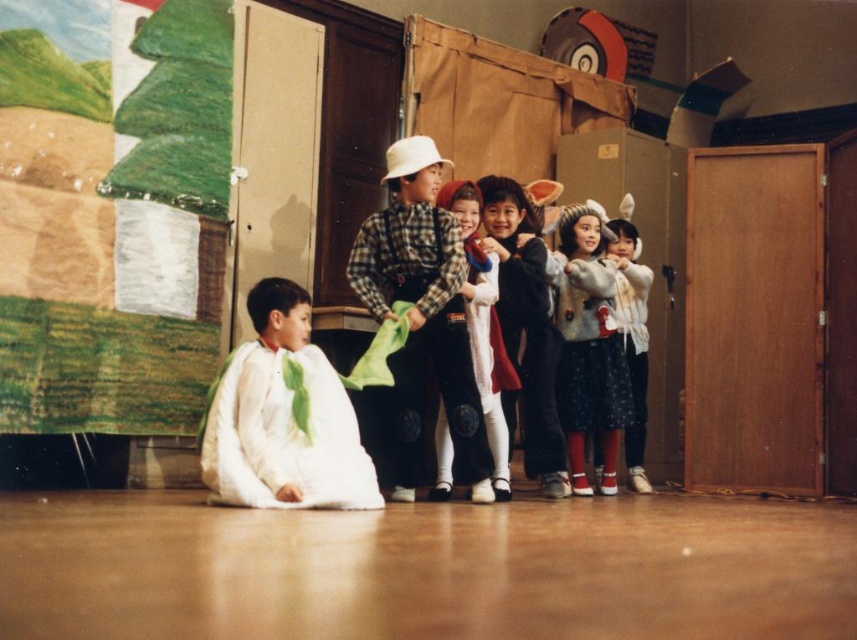
Question: Which of the following is the closest to the observer?

Choices:
 (A) fluffy white sweater at center
 (B) checkered fabric shirt at center
 (C) fuzzy gray sweater at center
 (D) green fabric tie at lower center

Answer: (D)

Question: From the image, what is the correct spatial relationship of white matte/soft fabric at lower left in relation to fluffy white sweater at center?

Choices:
 (A) right
 (B) left

Answer: (B)

Question: Which object is the farthest from the green fabric tie at lower center?

Choices:
 (A) fluffy white sweater at center
 (B) fuzzy gray sweater at center
 (C) white matte/soft fabric at lower left

Answer: (B)

Question: Among these points, which one is farthest from the camera?

Choices:
 (A) (631, 412)
 (B) (285, 356)
 (C) (355, 282)

Answer: (A)

Question: Is checkered fabric shirt at center thinner than green fabric tie at lower center?

Choices:
 (A) yes
 (B) no

Answer: (B)

Question: Can you confirm if fuzzy gray sweater at center is positioned below green fabric tie at lower center?

Choices:
 (A) no
 (B) yes

Answer: (A)